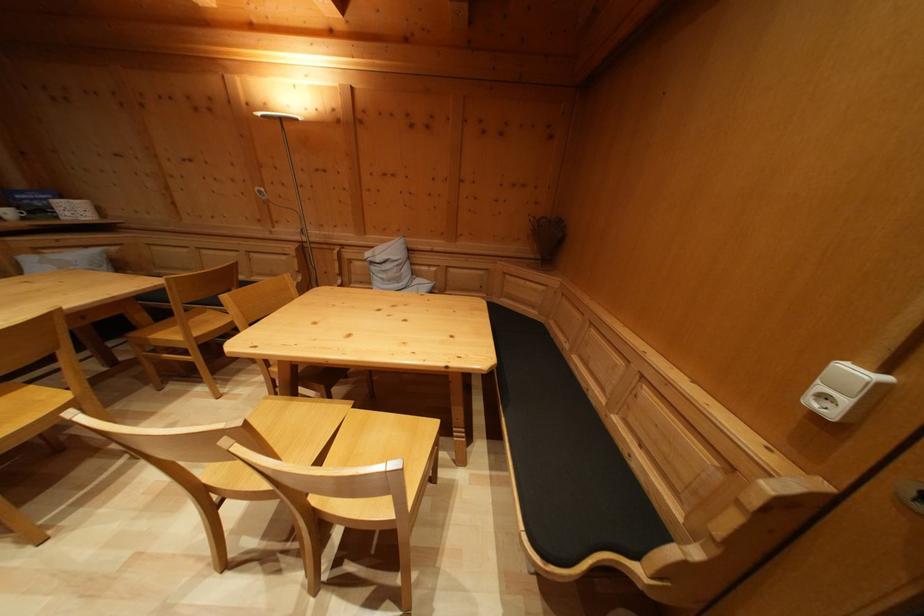
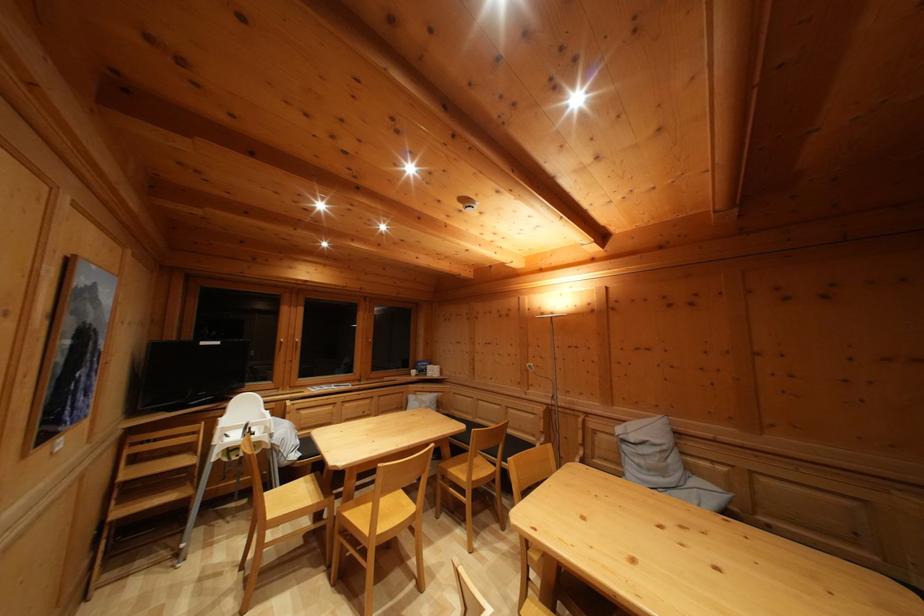
Find the pixel in the second image that matches point 379,275 in the first image.

(629, 454)